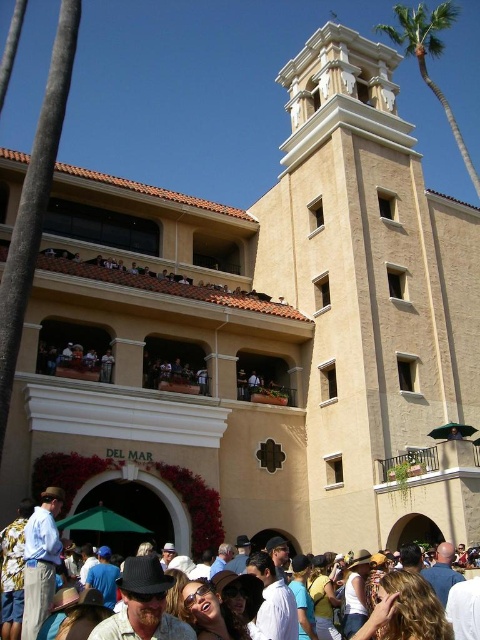
Question: Which of these objects is positioned closest to the multicolored fabric crowd at lower center?

Choices:
 (A) beige stucco bell tower at upper center
 (B) green leafy palm tree at upper right

Answer: (A)

Question: Which of the following is the closest to the observer?

Choices:
 (A) green leafy palm tree at upper right
 (B) multicolored fabric crowd at lower center
 (C) beige stucco bell tower at upper center

Answer: (B)

Question: Which of the following is the farthest from the observer?

Choices:
 (A) (412, 291)
 (B) (398, 29)

Answer: (B)

Question: Is beige stucco bell tower at upper center above multicolored fabric crowd at lower center?

Choices:
 (A) yes
 (B) no

Answer: (A)

Question: Can you confirm if beige stucco bell tower at upper center is positioned above multicolored fabric crowd at lower center?

Choices:
 (A) no
 (B) yes

Answer: (B)

Question: Is the position of multicolored fabric crowd at lower center less distant than that of green leafy palm tree at upper right?

Choices:
 (A) no
 (B) yes

Answer: (B)